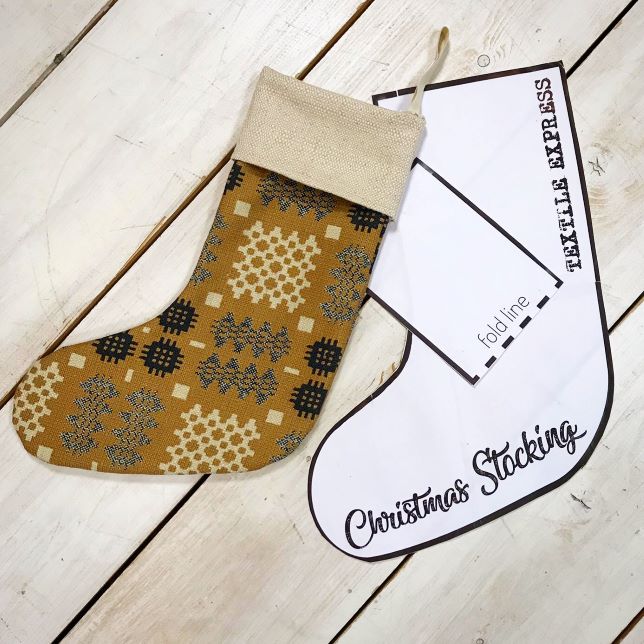
I want to click on stocking, so click(314, 229).